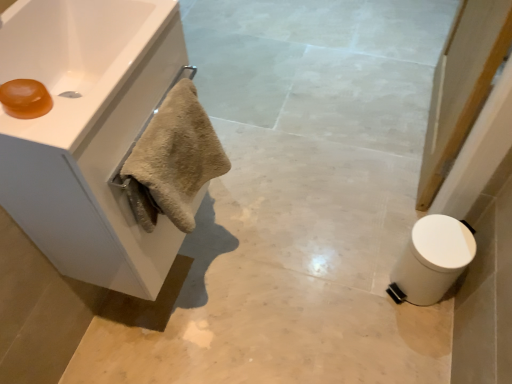
Find the location of a particular element. The width and height of the screenshot is (512, 384). vacant area that lies between white matte cabinet at upper left and white matte trash can at lower right is located at coordinates pyautogui.click(x=283, y=278).